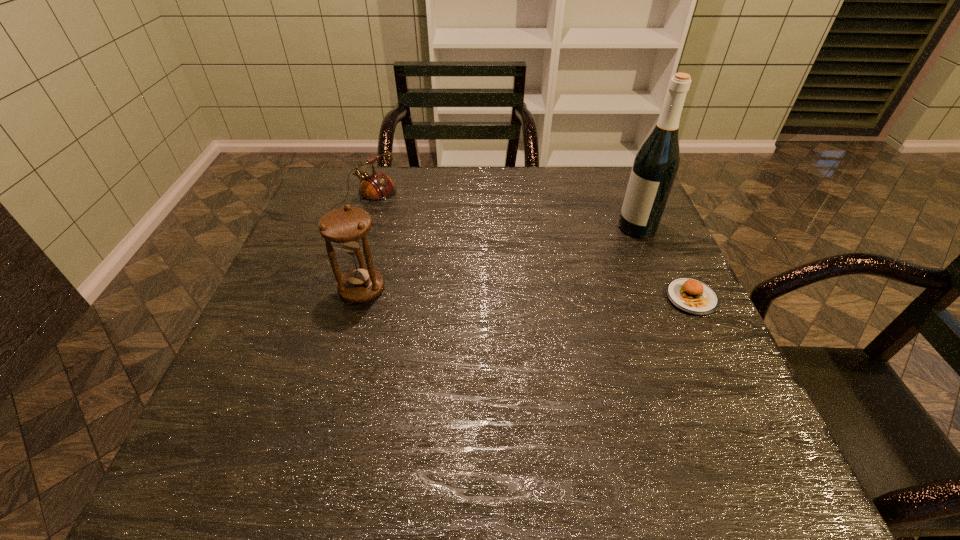
This screenshot has width=960, height=540. Identify the location of vacant position at the left edge of the desktop. (299, 245).

The width and height of the screenshot is (960, 540). I want to click on free space at the right edge, so click(655, 309).

The height and width of the screenshot is (540, 960). In the image, there is a desktop. In order to click on free region at the far left corner in this screenshot , I will do `click(327, 186)`.

The width and height of the screenshot is (960, 540). Find the location of `vacant space at the far right corner of the desktop`. vacant space at the far right corner of the desktop is located at coordinates (623, 190).

This screenshot has width=960, height=540. I want to click on vacant space at the near right corner, so [x=736, y=408].

Locate an element on the screen. vacant area that lies between the food and the third tallest object is located at coordinates (528, 251).

Where is `free spot between the food and the telephone`? free spot between the food and the telephone is located at coordinates (528, 251).

Find the location of a particular element. vacant area that lies between the telephone and the tallest object is located at coordinates (500, 215).

At what (x,y) coordinates should I click in order to perform the action: click on vacant space that is in between the tallest object and the third shortest object. Please return your answer as a coordinate pair (x, y). The image size is (960, 540). Looking at the image, I should click on (499, 258).

Image resolution: width=960 pixels, height=540 pixels. Find the location of `free space between the food and the hourglass`. free space between the food and the hourglass is located at coordinates (527, 294).